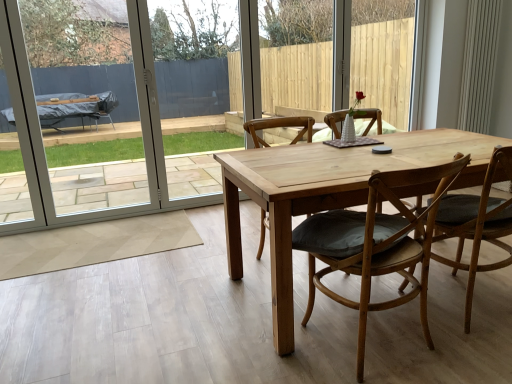
What are the coordinates of `vacant space positioned to the left of light brown wooden chair at center, which ranks as the 1th chair in left-to-right order` in the screenshot? It's located at (216, 267).